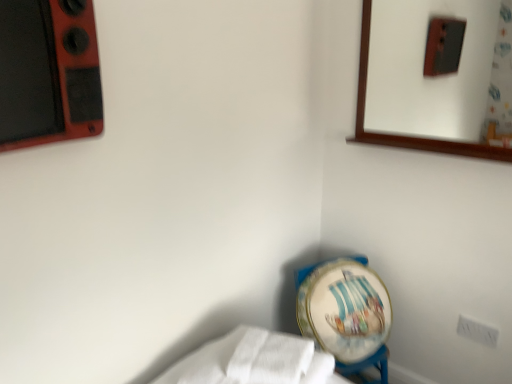
Question: Is white plastic electric outlet at lower right not near white fabric at lower left?

Choices:
 (A) yes
 (B) no

Answer: (B)

Question: Is white fabric at lower left inside white plastic electric outlet at lower right?

Choices:
 (A) no
 (B) yes

Answer: (A)

Question: Is white plastic electric outlet at lower right thinner than white fabric at lower left?

Choices:
 (A) no
 (B) yes

Answer: (B)

Question: Is white plastic electric outlet at lower right oriented away from white fabric at lower left?

Choices:
 (A) no
 (B) yes

Answer: (A)

Question: Does white plastic electric outlet at lower right have a larger size compared to white fabric at lower left?

Choices:
 (A) yes
 (B) no

Answer: (B)

Question: In the image, is painted ceramic globe at lower center positioned in front of or behind white fabric at lower left?

Choices:
 (A) behind
 (B) front

Answer: (A)

Question: Do you think painted ceramic globe at lower center is within white fabric at lower left, or outside of it?

Choices:
 (A) inside
 (B) outside

Answer: (B)

Question: Would you say painted ceramic globe at lower center is to the left or to the right of white fabric at lower left in the picture?

Choices:
 (A) left
 (B) right

Answer: (B)

Question: From a real-world perspective, is painted ceramic globe at lower center positioned above or below white fabric at lower left?

Choices:
 (A) below
 (B) above

Answer: (A)

Question: From their relative heights in the image, would you say white plastic electric outlet at lower right is taller or shorter than white fabric at lower left?

Choices:
 (A) tall
 (B) short

Answer: (A)

Question: Is point (473, 321) closer or farther from the camera than point (216, 362)?

Choices:
 (A) closer
 (B) farther

Answer: (B)

Question: From the image's perspective, is white plastic electric outlet at lower right located above or below white fabric at lower left?

Choices:
 (A) above
 (B) below

Answer: (B)

Question: Choose the correct answer: Is white plastic electric outlet at lower right inside white fabric at lower left or outside it?

Choices:
 (A) outside
 (B) inside

Answer: (A)

Question: Relative to painted ceramic globe at lower center, is white fabric at lower left in front or behind?

Choices:
 (A) front
 (B) behind

Answer: (A)

Question: From the image's perspective, relative to painted ceramic globe at lower center, is white fabric at lower left above or below?

Choices:
 (A) above
 (B) below

Answer: (A)